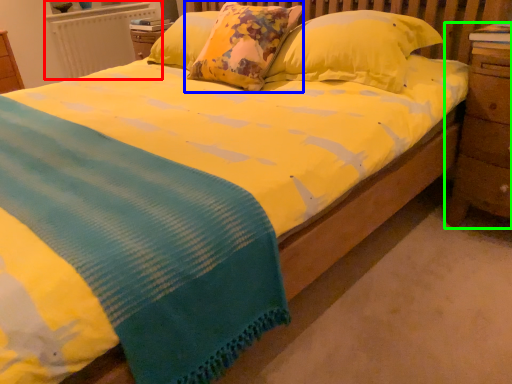
Question: Considering the real-world distances, which object is closest to radiator (highlighted by a red box)? pillow (highlighted by a blue box) or nightstand (highlighted by a green box).

Choices:
 (A) pillow
 (B) nightstand

Answer: (A)